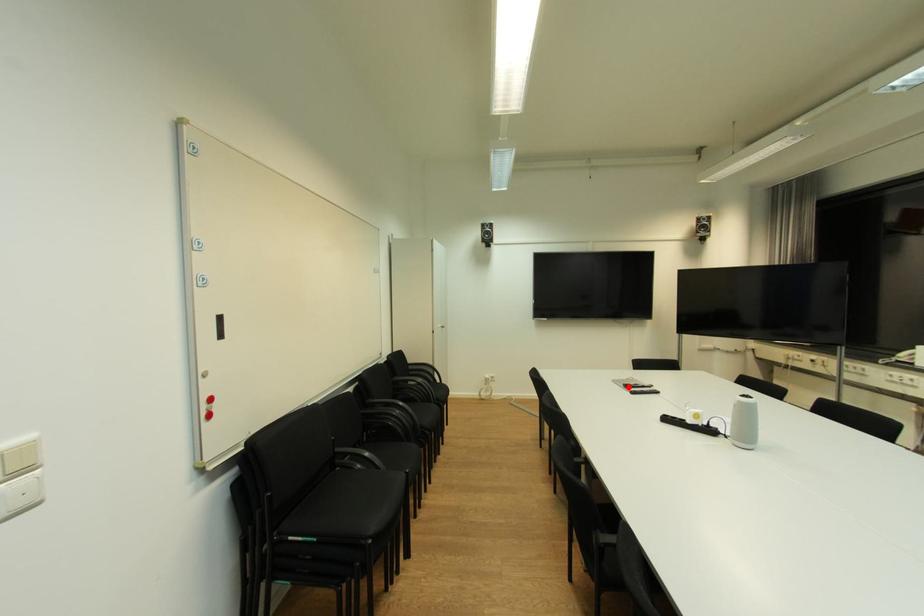
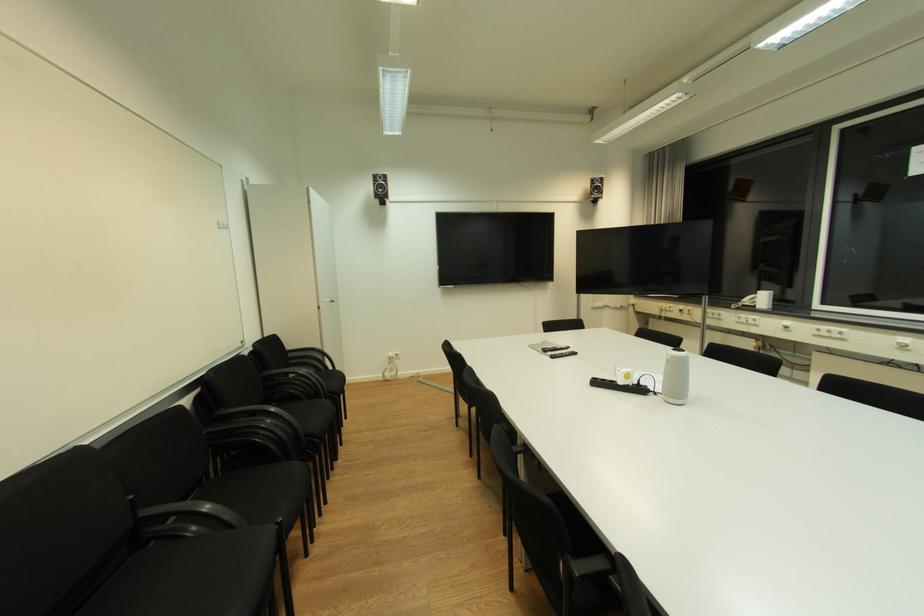
In the second image, find the point that corresponds to the highlighted location in the first image.

(546, 352)